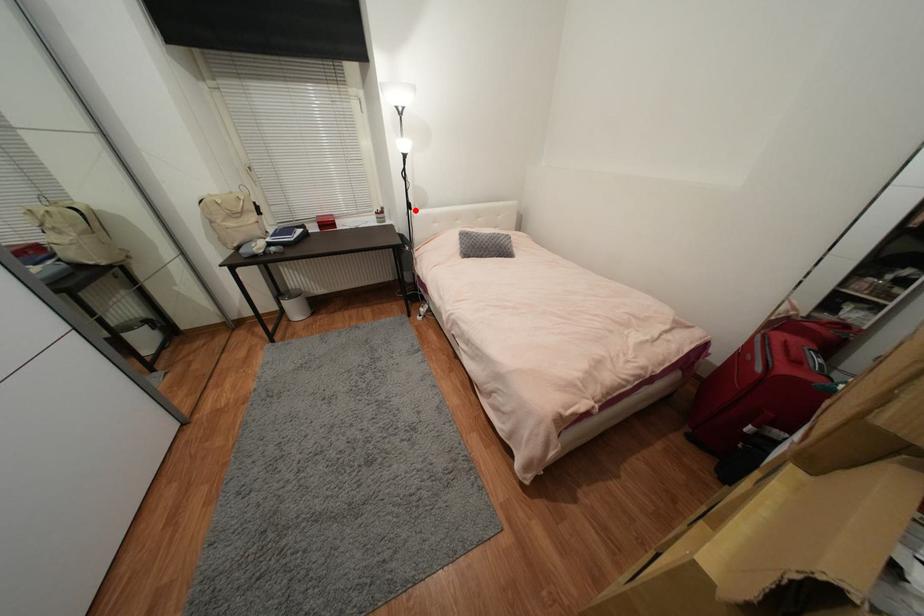
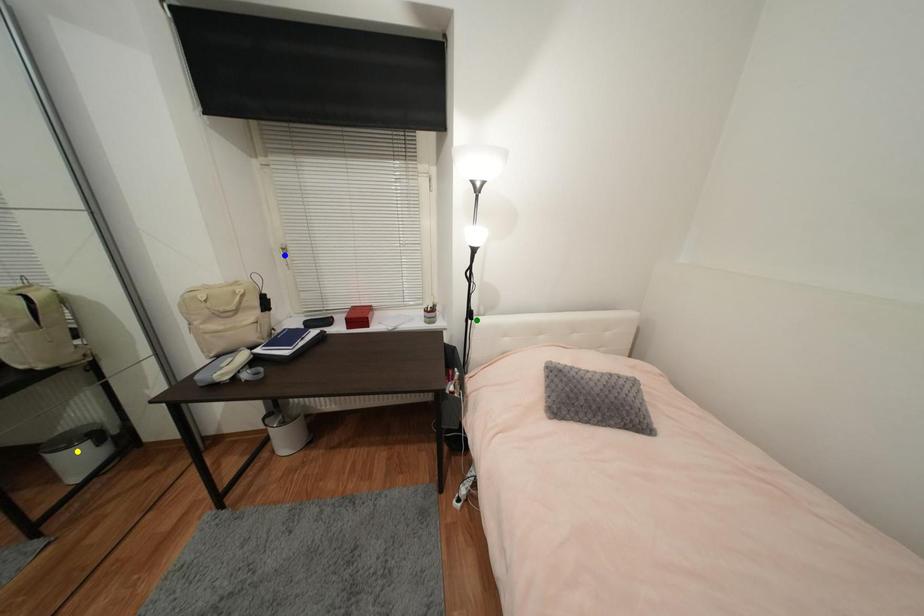
Question: I am providing you with two images of the same scene from different viewpoints. A red point is marked on the first image. You are given multiple points on the second image. In image 2, which mark is for the same physical point as the one in image 1?

Choices:
 (A) yellow point
 (B) blue point
 (C) green point

Answer: (C)